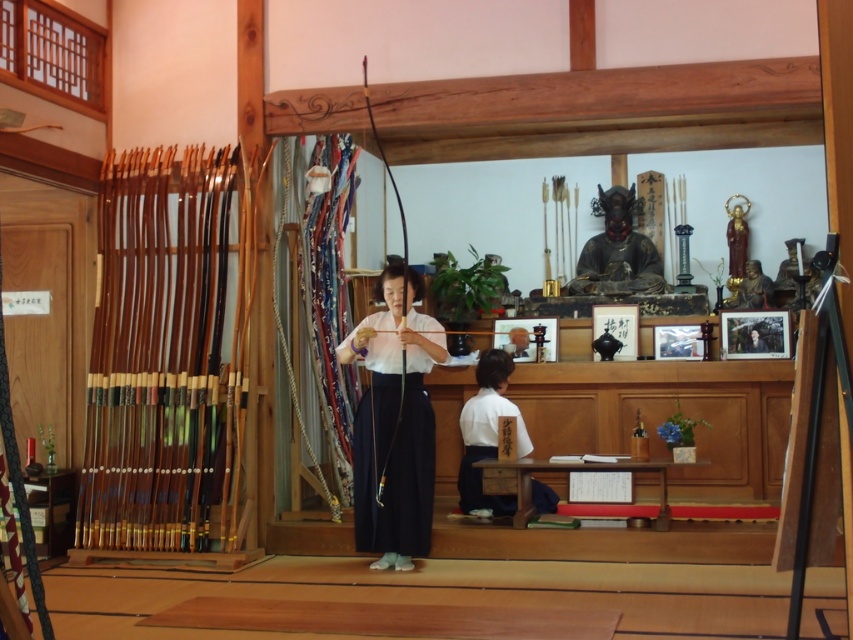
Question: Is black glossy statue at center above matte gold statue at upper center?

Choices:
 (A) no
 (B) yes

Answer: (B)

Question: Is matte white shirt at center positioned in front of white cotton kimono at lower center?

Choices:
 (A) no
 (B) yes

Answer: (B)

Question: Among these objects, which one is nearest to the camera?

Choices:
 (A) gold statue at upper right
 (B) white cotton kimono at lower center

Answer: (B)

Question: Is white cotton kimono at lower center to the left of matte gold statue at upper center from the viewer's perspective?

Choices:
 (A) yes
 (B) no

Answer: (A)

Question: Which of the following is the farthest from the observer?

Choices:
 (A) gold statue at upper right
 (B) matte white shirt at center
 (C) matte gold statue at upper center

Answer: (A)

Question: Which object appears closest to the camera in this image?

Choices:
 (A) matte white shirt at center
 (B) white cotton kimono at lower center
 (C) black glossy statue at center

Answer: (A)